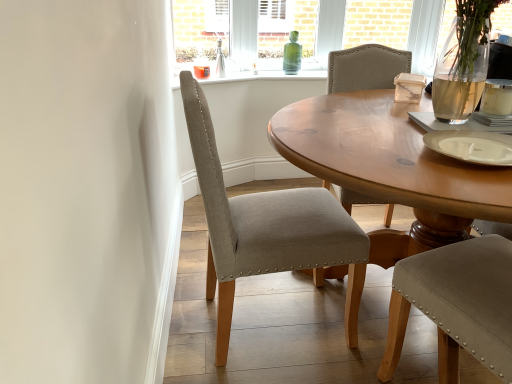
Question: Is green glass bottle at center taller than white matte plate at center-right?

Choices:
 (A) no
 (B) yes

Answer: (B)

Question: Can you confirm if green glass bottle at center is smaller than white matte plate at center-right?

Choices:
 (A) yes
 (B) no

Answer: (B)

Question: Can you confirm if green glass bottle at center is positioned to the right of white matte plate at center-right?

Choices:
 (A) no
 (B) yes

Answer: (A)

Question: Is green glass bottle at center behind white matte plate at center-right?

Choices:
 (A) yes
 (B) no

Answer: (A)

Question: Can white matte plate at center-right be found inside green glass bottle at center?

Choices:
 (A) yes
 (B) no

Answer: (B)

Question: From a real-world perspective, does green glass bottle at center stand above white matte plate at center-right?

Choices:
 (A) yes
 (B) no

Answer: (A)

Question: Does green glass bottle at center have a greater width compared to white ceramic coffee cup at upper right?

Choices:
 (A) no
 (B) yes

Answer: (B)

Question: From a real-world perspective, is green glass bottle at center positioned over white ceramic coffee cup at upper right based on gravity?

Choices:
 (A) no
 (B) yes

Answer: (A)

Question: Is green glass bottle at center far from white ceramic coffee cup at upper right?

Choices:
 (A) yes
 (B) no

Answer: (A)

Question: From the image's perspective, is green glass bottle at center below white ceramic coffee cup at upper right?

Choices:
 (A) yes
 (B) no

Answer: (B)

Question: Is green glass bottle at center oriented towards white ceramic coffee cup at upper right?

Choices:
 (A) no
 (B) yes

Answer: (B)

Question: Considering the relative sizes of green glass bottle at center and white ceramic coffee cup at upper right in the image provided, is green glass bottle at center taller than white ceramic coffee cup at upper right?

Choices:
 (A) no
 (B) yes

Answer: (B)

Question: Is green glass bottle at center looking in the opposite direction of light gray fabric chair at center?

Choices:
 (A) no
 (B) yes

Answer: (A)